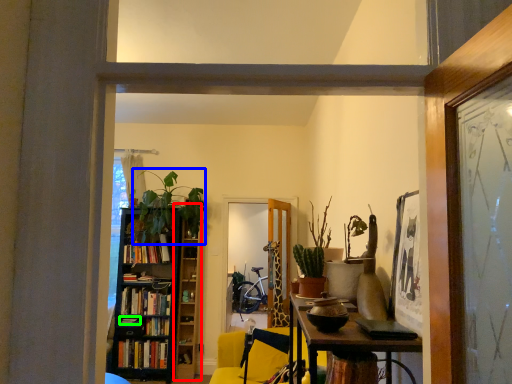
Question: Estimate the real-world distances between objects in this image. Which object is closer to bookshelf (highlighted by a red box), plant (highlighted by a blue box) or book (highlighted by a green box)?

Choices:
 (A) plant
 (B) book

Answer: (A)